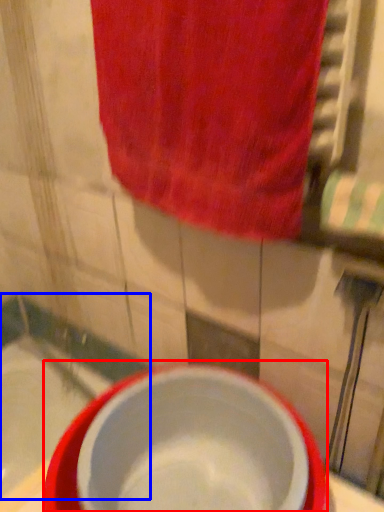
Question: Which object is closer to the camera taking this photo, basin (highlighted by a red box) or bath (highlighted by a blue box)?

Choices:
 (A) basin
 (B) bath

Answer: (A)